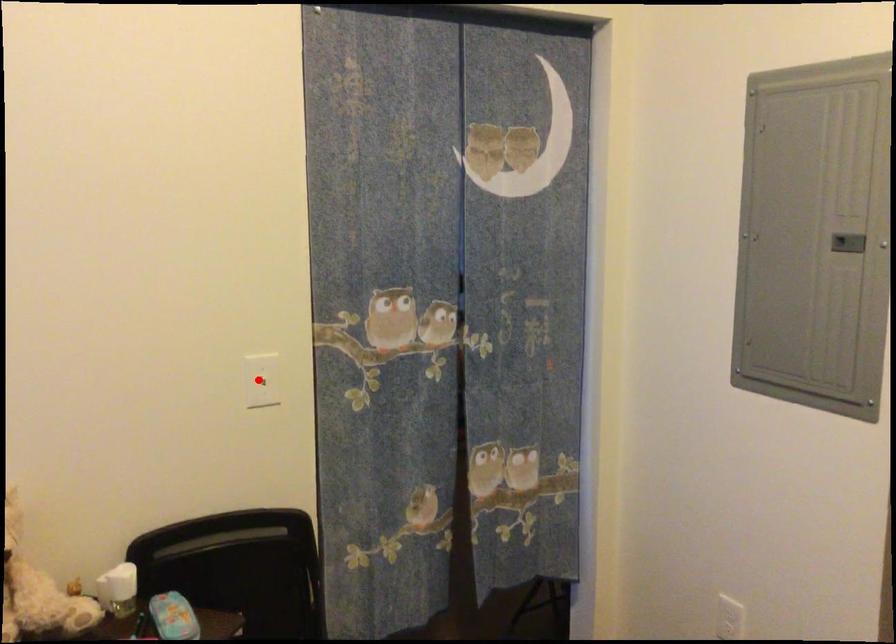
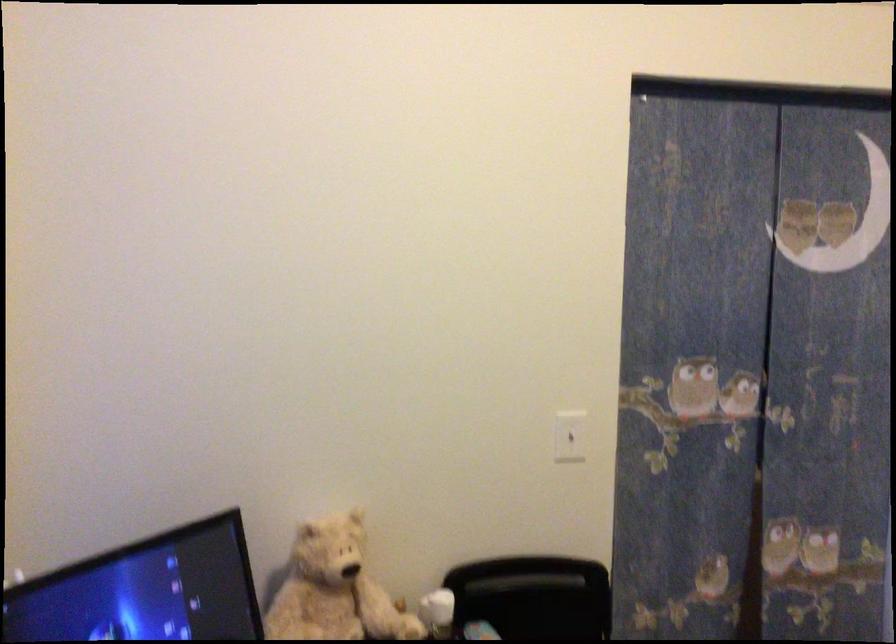
In the second image, find the point that corresponds to the highlighted location in the first image.

(570, 436)